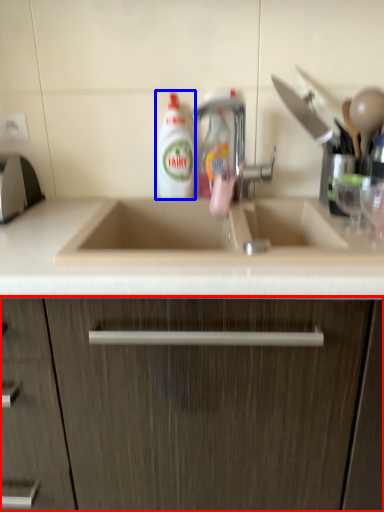
Question: Among these objects, which one is nearest to the camera, cabinetry (highlighted by a red box) or cleaning product (highlighted by a blue box)?

Choices:
 (A) cabinetry
 (B) cleaning product

Answer: (A)